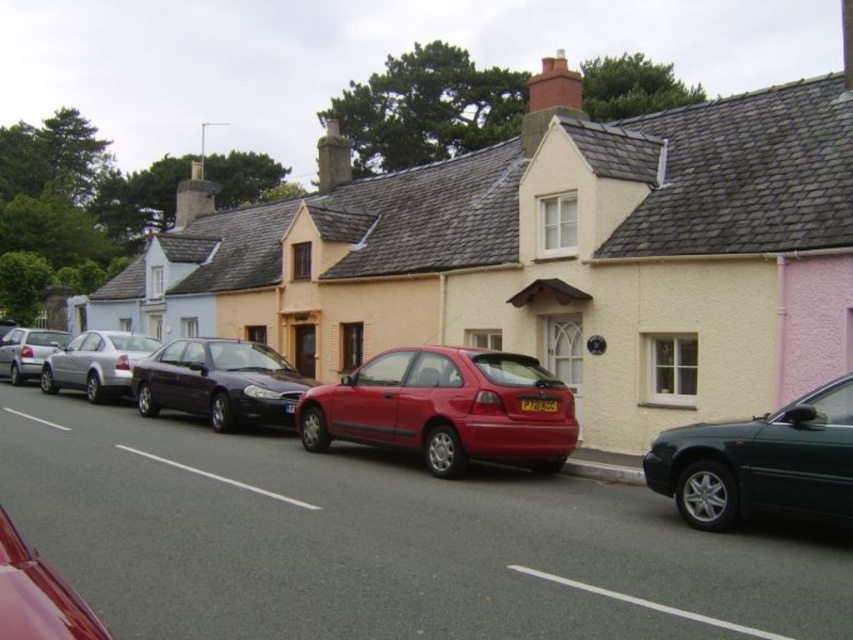
Question: Where is shiny black sedan at center located in relation to metallic red car at lower left in the image?

Choices:
 (A) right
 (B) left

Answer: (B)

Question: Which object is positioned closest to the metallic red hatchback at center?

Choices:
 (A) metallic red car at lower left
 (B) metallic dark green sedan at right
 (C) silver metallic sedan at center

Answer: (B)

Question: From the image, what is the correct spatial relationship of metallic dark green sedan at right in relation to white asphalt line at center?

Choices:
 (A) below
 (B) above

Answer: (B)

Question: Is metallic red car at lower left wider than silver metallic sedan at center?

Choices:
 (A) yes
 (B) no

Answer: (A)

Question: Which object is closer to the camera taking this photo?

Choices:
 (A) metallic red hatchback at center
 (B) white asphalt line at center
 (C) black plastic license plate at center
 (D) silver metallic hatchback at left

Answer: (B)

Question: Among these objects, which one is nearest to the camera?

Choices:
 (A) metallic dark green sedan at right
 (B) shiny black sedan at center
 (C) metallic red car at lower left

Answer: (C)